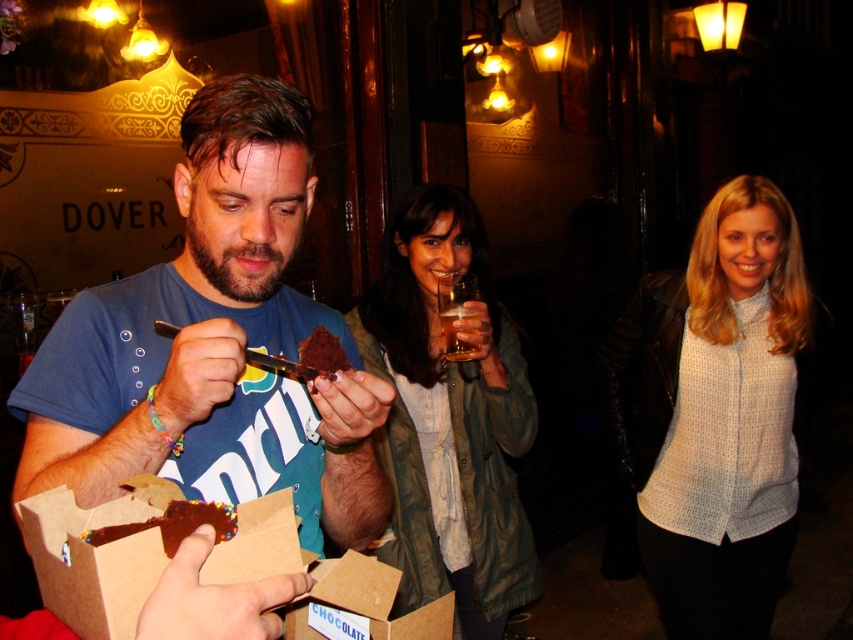
Describe the element at coordinates (454, 326) in the screenshot. I see `translucent glass at center` at that location.

Who is higher up, translucent glass at center or chocolate cake at center?

translucent glass at center

Between point (474, 307) and point (326, 369), which one is positioned in front?

Point (326, 369) is in front.

At what (x,y) coordinates should I click in order to perform the action: click on translucent glass at center. Please return your answer as a coordinate pair (x, y). Looking at the image, I should click on (454, 326).

Is green textured jacket at center to the right of translucent glass at center from the viewer's perspective?

Incorrect, green textured jacket at center is not on the right side of translucent glass at center.

Is green textured jacket at center wider than translucent glass at center?

Yes.

Does point (463, 362) lie behind point (474, 349)?

Yes, it is behind point (474, 349).

This screenshot has width=853, height=640. What are the coordinates of `green textured jacket at center` in the screenshot? It's located at (450, 420).

Is white textured shirt at center to the left of chocolate-coated cookie at center from the viewer's perspective?

In fact, white textured shirt at center is to the right of chocolate-coated cookie at center.

Image resolution: width=853 pixels, height=640 pixels. I want to click on white textured shirt at center, so click(718, 413).

You are a GUI agent. You are given a task and a screenshot of the screen. Output one action in this format:
    pyautogui.click(x=<x>, y=<y>)
    Task: Click on the white textured shirt at center
    This screenshot has width=853, height=640.
    Given the screenshot: What is the action you would take?
    pyautogui.click(x=718, y=413)